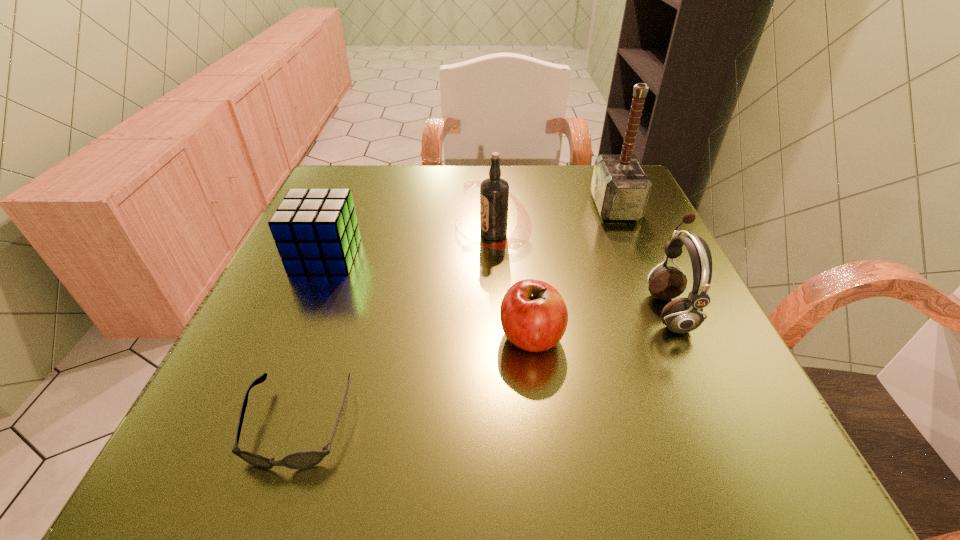
Where is `free space between the apple and the earphone`? free space between the apple and the earphone is located at coordinates (600, 323).

Locate an element on the screen. The image size is (960, 540). empty space that is in between the tallest object and the root beer is located at coordinates (554, 220).

The image size is (960, 540). What are the coordinates of `the second closest object relative to the cube` in the screenshot? It's located at click(306, 459).

Identify the location of object identified as the second closest to the root beer. Image resolution: width=960 pixels, height=540 pixels. (620, 187).

You are a GUI agent. You are given a task and a screenshot of the screen. Output one action in this format:
    pyautogui.click(x=<x>, y=<y>)
    Task: Click on the vacant space that satisfies the following two spatial constraints: 1. on the ear pads of the earphone; 2. on the lenses of the nearest object
    This screenshot has height=540, width=960.
    Given the screenshot: What is the action you would take?
    (x=721, y=426)

I want to click on vacant space that satisfies the following two spatial constraints: 1. on the front side of the tallest object; 2. on the label of the root beer, so click(x=626, y=234).

Where is `free space in the image that satisfies the following two spatial constraints: 1. on the label of the apple; 2. on the left side of the root beer`? Image resolution: width=960 pixels, height=540 pixels. free space in the image that satisfies the following two spatial constraints: 1. on the label of the apple; 2. on the left side of the root beer is located at coordinates coord(496,336).

Where is `blank area in the image that satisfies the following two spatial constraints: 1. on the label of the root beer; 2. on the right side of the apple`? The width and height of the screenshot is (960, 540). blank area in the image that satisfies the following two spatial constraints: 1. on the label of the root beer; 2. on the right side of the apple is located at coordinates click(496, 336).

Where is `vacant space that satisfies the following two spatial constraints: 1. on the label of the root beer; 2. on the lenses of the sunglasses`? The width and height of the screenshot is (960, 540). vacant space that satisfies the following two spatial constraints: 1. on the label of the root beer; 2. on the lenses of the sunglasses is located at coordinates (499, 426).